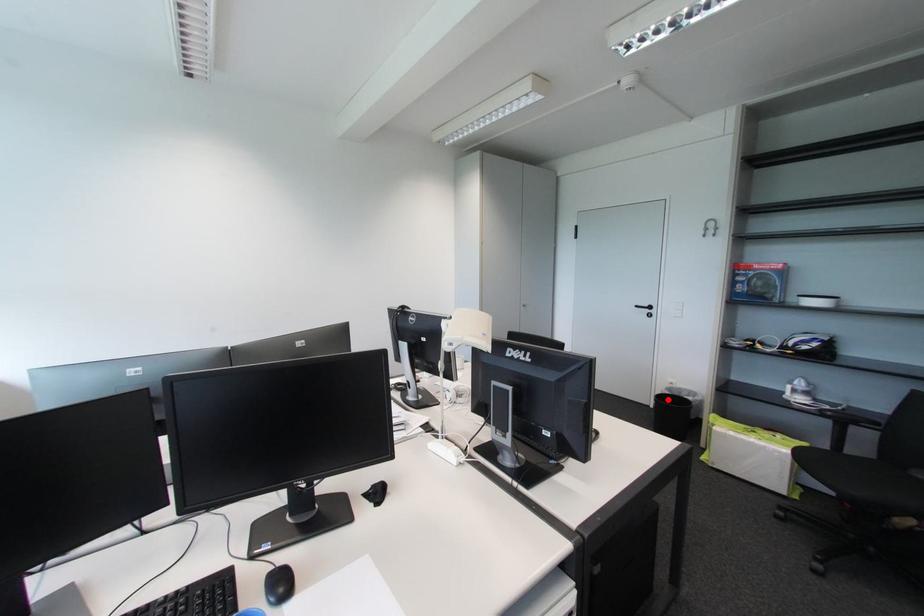
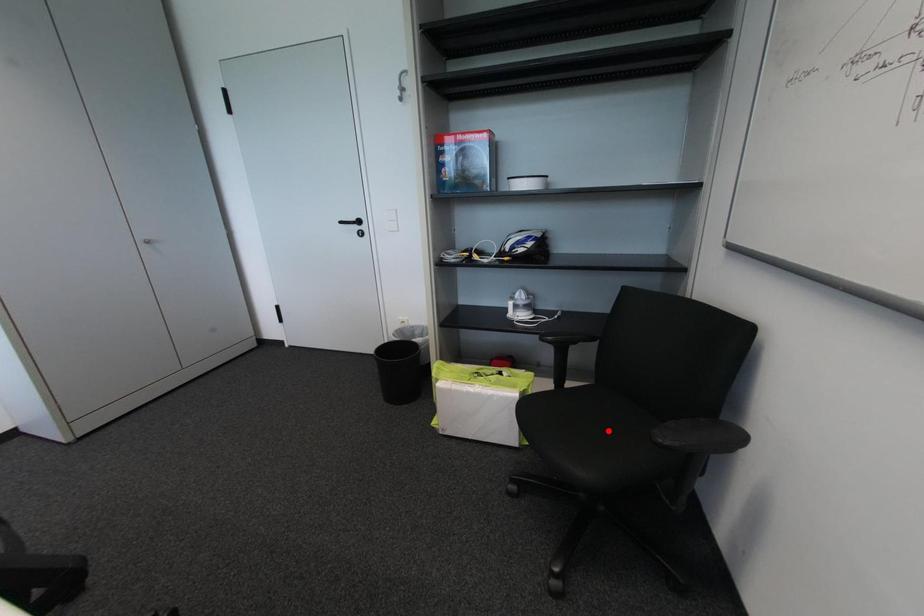
I am providing you with two images of the same scene from different viewpoints. A red point is marked on the first image and another point is marked on the second image. Is the marked point in image1 the same physical position as the marked point in image2?

No